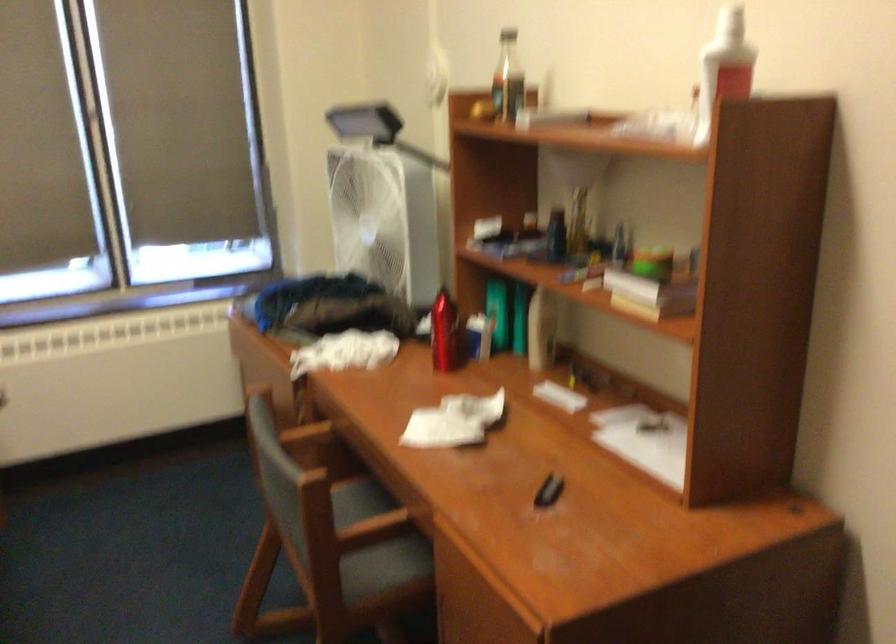
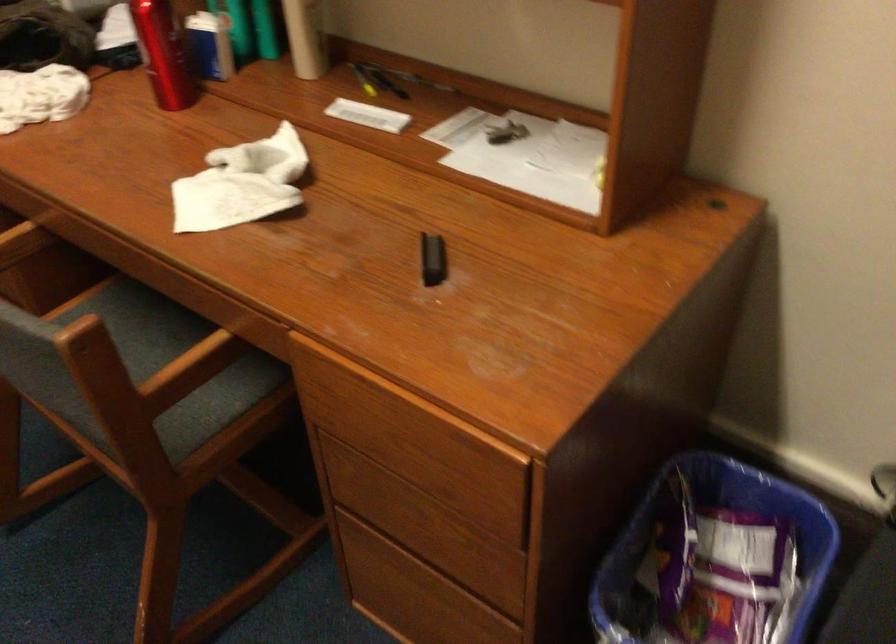
Find the pixel in the second image that matches (655,426) in the first image.

(504, 131)